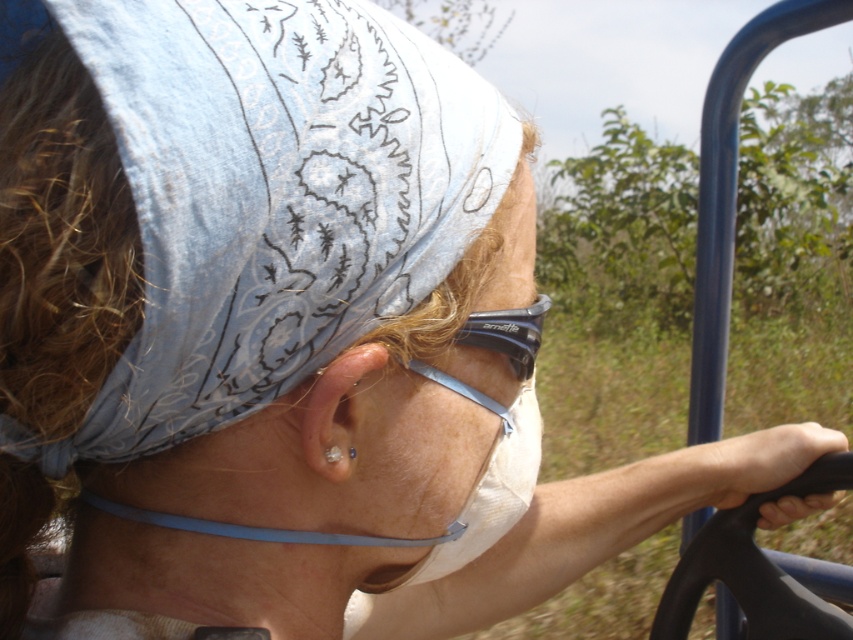
Question: Is denim bandana at upper left above black rubber goggles at upper center?

Choices:
 (A) no
 (B) yes

Answer: (B)

Question: Is denim bandana at upper left below white fabric mask at center?

Choices:
 (A) no
 (B) yes

Answer: (A)

Question: Which object is positioned closest to the denim bandana at upper left?

Choices:
 (A) black rubber goggles at upper center
 (B) white fabric mask at center

Answer: (B)

Question: Which point is closer to the camera?

Choices:
 (A) (76, 429)
 (B) (480, 337)
 (C) (482, 356)

Answer: (A)

Question: Which is nearer to the denim bandana at upper left?

Choices:
 (A) white fabric mask at center
 (B) black rubber goggles at upper center

Answer: (A)

Question: Observing the image, what is the correct spatial positioning of white fabric mask at center in reference to black rubber goggles at upper center?

Choices:
 (A) left
 (B) right

Answer: (A)